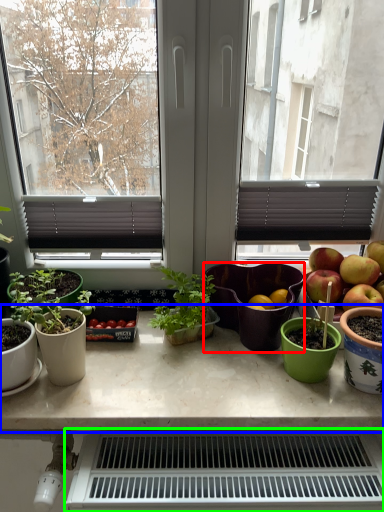
Question: Considering the real-world distances, which object is farthest from salad bowl (highlighted by a red box)? table (highlighted by a blue box) or appliance (highlighted by a green box)?

Choices:
 (A) table
 (B) appliance

Answer: (B)